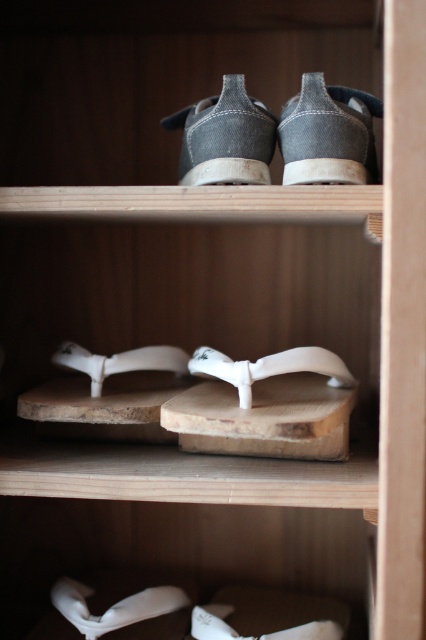
Who is higher up, white rubber sandal at center or white matte sandal at center?

white matte sandal at center is higher up.

Between point (288, 365) and point (152, 348), which one is positioned behind?

The point (152, 348) is behind.

Find the location of a particular element. white rubber sandal at center is located at coordinates (268, 368).

Who is lower down, denim canvas sneaker at upper center or white matte sandal at center?

Positioned lower is white matte sandal at center.

The height and width of the screenshot is (640, 426). Find the location of `denim canvas sneaker at upper center`. denim canvas sneaker at upper center is located at coordinates (328, 134).

Between dark gray canvas shoe at upper center and white matte sandal at center, which one appears on the right side from the viewer's perspective?

dark gray canvas shoe at upper center is more to the right.

Can you confirm if dark gray canvas shoe at upper center is smaller than white matte sandal at center?

No.

Who is more distant from viewer, (238, 168) or (147, 356)?

The point (147, 356) is more distant.

I want to click on dark gray canvas shoe at upper center, so click(224, 138).